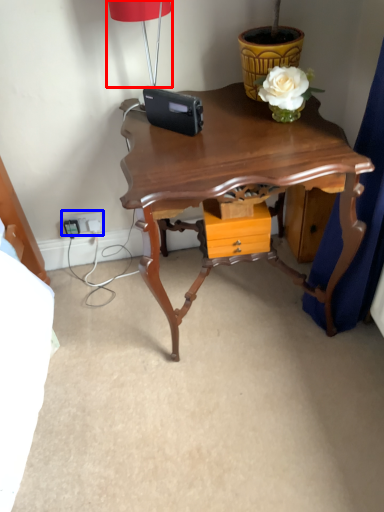
Question: Among these objects, which one is nearest to the camera, lamp (highlighted by a red box) or electric outlet (highlighted by a blue box)?

Choices:
 (A) lamp
 (B) electric outlet

Answer: (A)